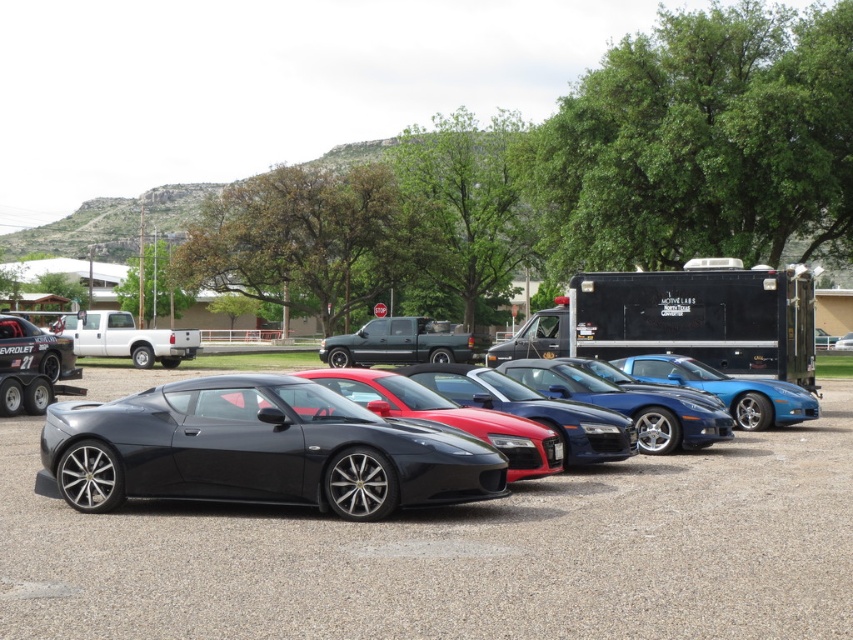
What do you see at coordinates (448, 417) in the screenshot?
I see `glossy black sports car at center` at bounding box center [448, 417].

Is glossy black sports car at center wider than matte black truck at center?

No.

Locate an element on the screen. Image resolution: width=853 pixels, height=640 pixels. glossy black sports car at center is located at coordinates (448, 417).

Where is `glossy black sports car at center`? glossy black sports car at center is located at coordinates (448, 417).

Between glossy black car at center and matte black truck at center, which one appears on the right side from the viewer's perspective?

From the viewer's perspective, glossy black car at center appears more on the right side.

Is point (656, 580) farther from camera compared to point (397, 333)?

That is False.

Who is more forward, (633, 461) or (393, 355)?

Positioned in front is point (633, 461).

Where is `glossy black car at center`? The width and height of the screenshot is (853, 640). glossy black car at center is located at coordinates (461, 554).

Between point (581, 308) and point (525, 467), which one is positioned behind?

Point (581, 308)

Is black matte trailer at center to the right of glossy black sports car at center from the viewer's perspective?

Yes, black matte trailer at center is to the right of glossy black sports car at center.

Identify the location of black matte trailer at center. The height and width of the screenshot is (640, 853). (699, 317).